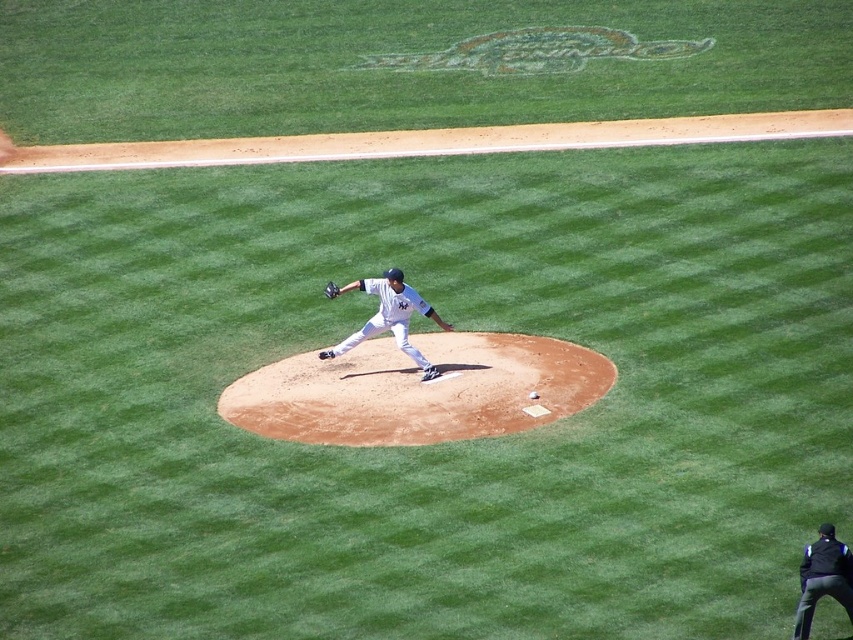
Question: Where is white matte uniform at center located in relation to white matte baseball at center in the image?

Choices:
 (A) above
 (B) below

Answer: (A)

Question: Which point is farther to the camera?

Choices:
 (A) white matte uniform at center
 (B) black fabric jacket at lower right
 (C) white matte baseball at center

Answer: (A)

Question: Is white matte uniform at center to the left of dark brown leather glove at center from the viewer's perspective?

Choices:
 (A) no
 (B) yes

Answer: (A)

Question: Which object is the farthest from the dark brown leather glove at center?

Choices:
 (A) brown dirt mound at center
 (B) white matte uniform at center

Answer: (A)

Question: Can you confirm if white matte uniform at center is positioned below dark brown leather glove at center?

Choices:
 (A) yes
 (B) no

Answer: (A)

Question: Which point is farther to the camera?

Choices:
 (A) (323, 289)
 (B) (392, 292)

Answer: (A)